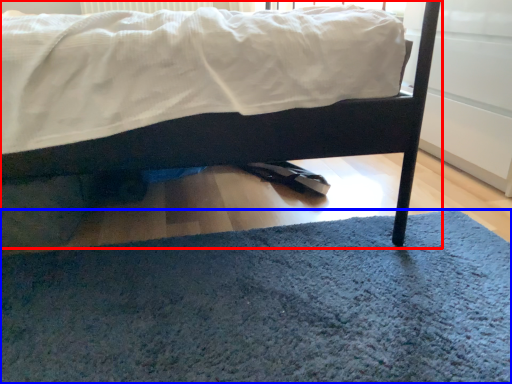
Question: Which object is closer to the camera taking this photo, bed (highlighted by a red box) or doormat (highlighted by a blue box)?

Choices:
 (A) bed
 (B) doormat

Answer: (B)